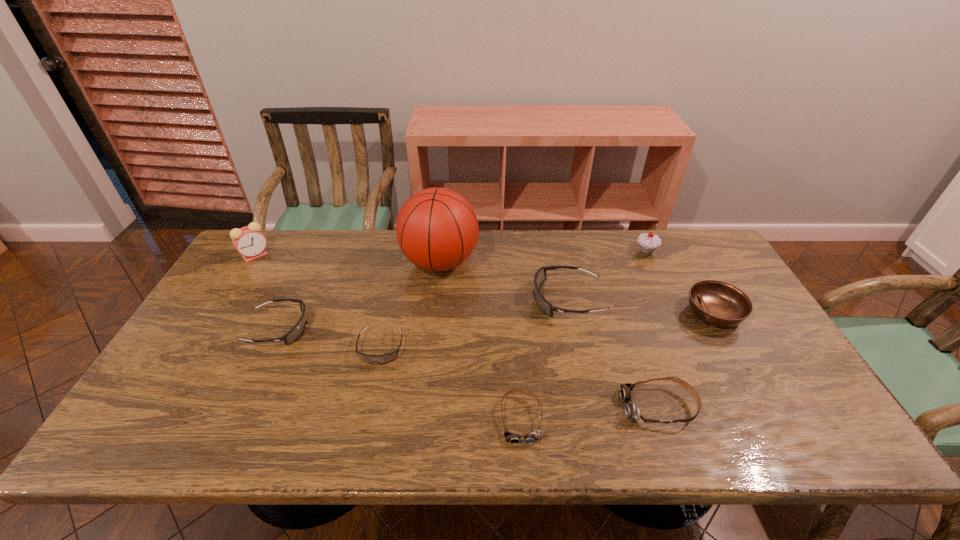
Locate an element on the screen. goggles at the left edge is located at coordinates (295, 333).

This screenshot has height=540, width=960. Identify the location of object at the right edge. (718, 303).

Identify the location of object situated at the far left corner. Image resolution: width=960 pixels, height=540 pixels. (249, 241).

In the image, there is a desktop. Where is `free space at the far edge`? This screenshot has width=960, height=540. free space at the far edge is located at coordinates (509, 260).

In the image, there is a desktop. At what (x,y) coordinates should I click in order to perform the action: click on vacant area at the near edge. Please return your answer as a coordinate pair (x, y). This screenshot has height=540, width=960. Looking at the image, I should click on (208, 425).

In order to click on free space at the left edge of the desktop in this screenshot , I will do click(250, 319).

Where is `vacant space at the far right corner of the desktop`? This screenshot has height=540, width=960. vacant space at the far right corner of the desktop is located at coordinates (682, 245).

You are a GUI agent. You are given a task and a screenshot of the screen. Output one action in this format:
    pyautogui.click(x=<x>, y=<y>)
    Task: Click on the free space between the eighth object from right to left and the basketball
    
    Given the screenshot: What is the action you would take?
    pyautogui.click(x=359, y=295)

Identify the location of free space between the soup bowl and the bigger brown goggles. (686, 360).

The width and height of the screenshot is (960, 540). In order to click on vacant region between the right brown goggles and the pink alarm clock in this screenshot , I will do `click(457, 331)`.